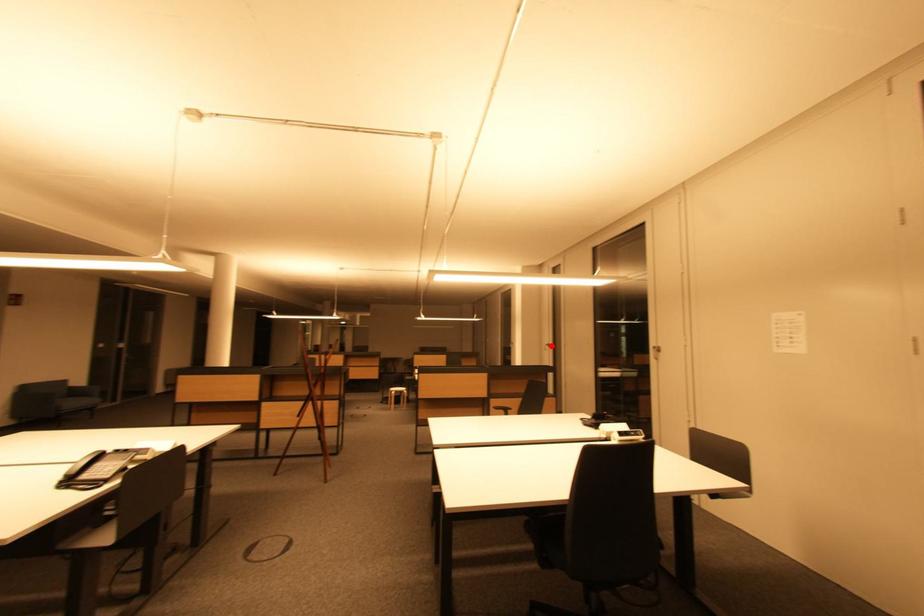
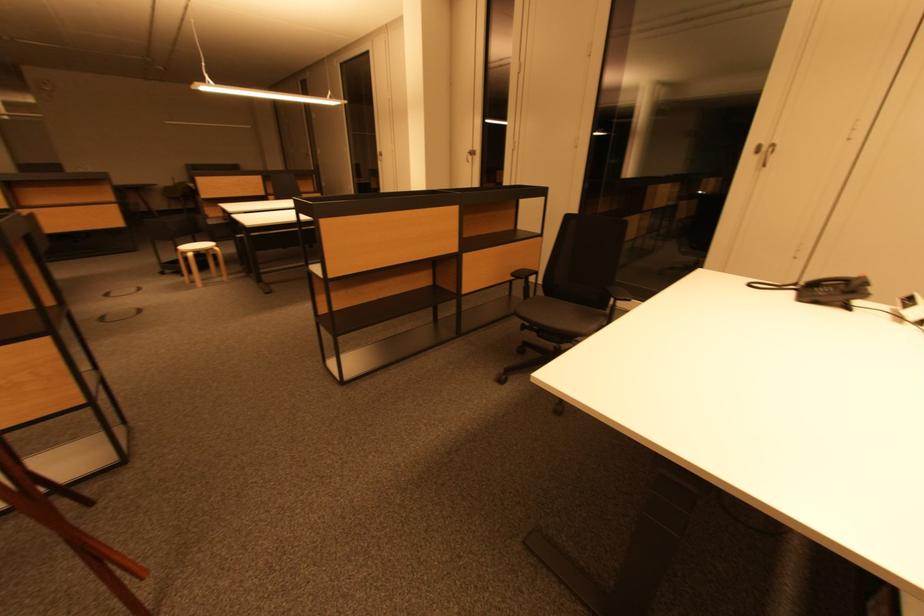
Where in the second image is the point corresponding to the highlighted location from the first image?

(470, 152)